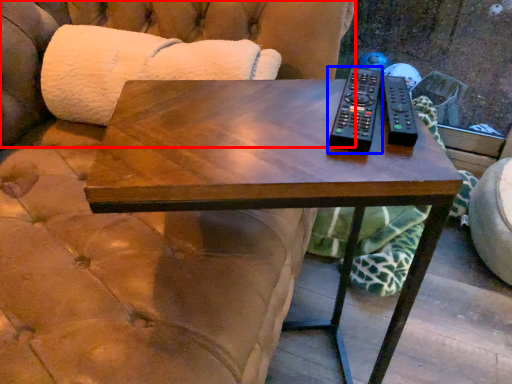
Question: Which point is closer to the camera, couch (highlighted by a red box) or remote (highlighted by a blue box)?

Choices:
 (A) couch
 (B) remote

Answer: (B)